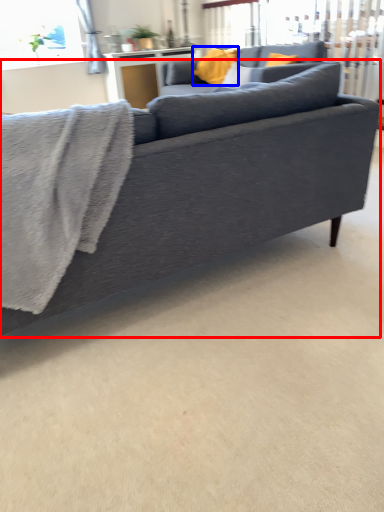
Question: Among these objects, which one is nearest to the camera, studio couch (highlighted by a red box) or pillow (highlighted by a blue box)?

Choices:
 (A) studio couch
 (B) pillow

Answer: (A)